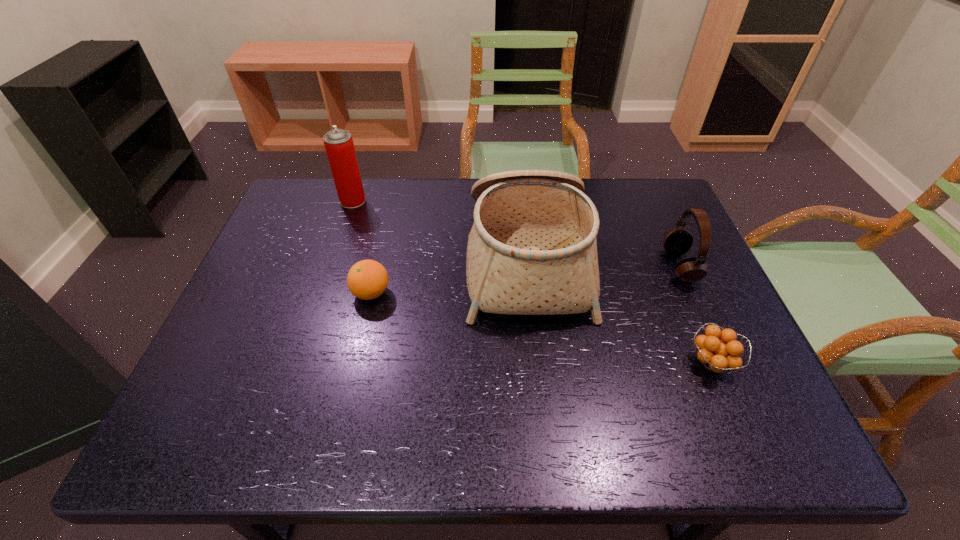
Identify the location of vacant area situated 0.330m with the lid open on the basket. (345, 260).

The width and height of the screenshot is (960, 540). I want to click on vacant space located 0.310m on the ear pads of the third tallest object, so click(x=548, y=266).

Where is `vacant space situated on the ear pads of the third tallest object`? vacant space situated on the ear pads of the third tallest object is located at coordinates (518, 266).

This screenshot has height=540, width=960. Find the location of `free space located 0.360m on the ear pads of the third tallest object`. free space located 0.360m on the ear pads of the third tallest object is located at coordinates (529, 266).

The height and width of the screenshot is (540, 960). What are the coordinates of `vacant area situated on the back of the left orange fruit` in the screenshot? It's located at (382, 247).

Identify the location of vacant space situated on the back of the nearest object. (684, 298).

Find the location of a particular element. This screenshot has width=960, height=540. aerosol can located in the far edge section of the desktop is located at coordinates (339, 146).

I want to click on basket that is at the far edge, so click(x=532, y=250).

The height and width of the screenshot is (540, 960). I want to click on object present at the left edge, so click(339, 146).

Locate an element on the screen. This screenshot has width=960, height=540. headset at the right edge is located at coordinates (678, 241).